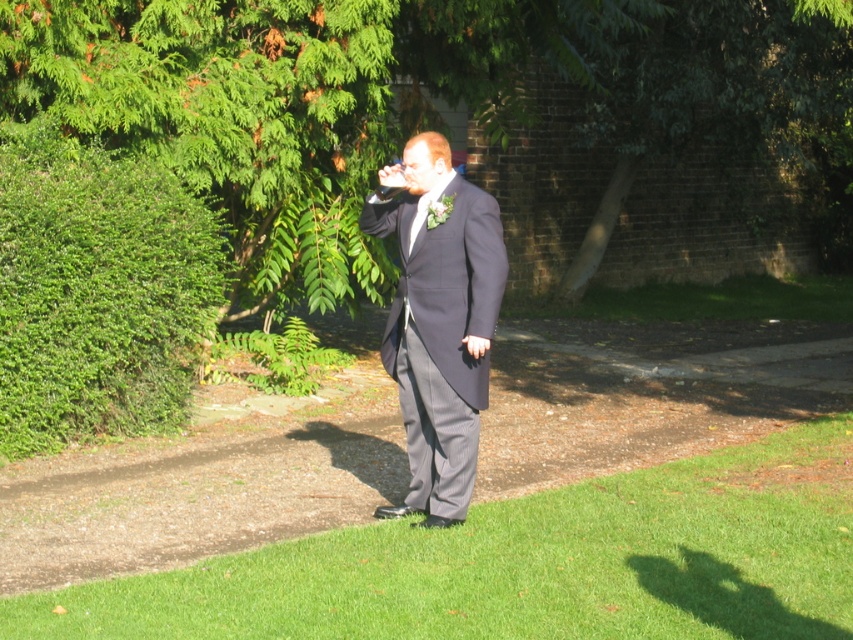
Question: Is green leafy tree at upper left smaller than dark gray suit at center?

Choices:
 (A) yes
 (B) no

Answer: (B)

Question: In this image, where is green leafy tree at upper left located relative to dark gray suit at center?

Choices:
 (A) below
 (B) above

Answer: (B)

Question: Which is nearer to the green leafy tree at upper left?

Choices:
 (A) green grass at lower center
 (B) green leafy hedge at left
 (C) dark gray suit at center

Answer: (B)

Question: Which point is farther from the camera taking this photo?

Choices:
 (A) (474, 326)
 (B) (172, 188)
 (C) (297, 202)
 (D) (390, 625)

Answer: (C)

Question: Where is green leafy tree at upper left located in relation to green grass at lower center in the image?

Choices:
 (A) below
 (B) above

Answer: (B)

Question: Which object is closer to the camera taking this photo?

Choices:
 (A) green grass at lower center
 (B) green leafy hedge at left
 (C) dark gray suit at center
 (D) green leafy tree at upper left

Answer: (A)